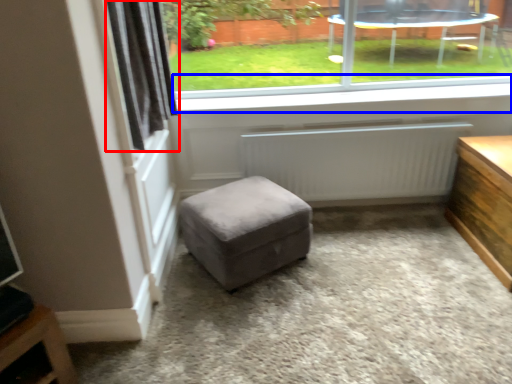
Question: Among these objects, which one is farthest to the camera, curtain (highlighted by a red box) or window sill (highlighted by a blue box)?

Choices:
 (A) curtain
 (B) window sill

Answer: (B)